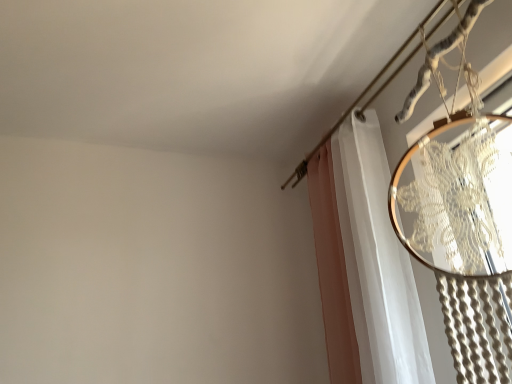
Question: Considering the positions of white sheer curtain at upper right and metallic silver clothesline at upper right in the image, is white sheer curtain at upper right taller or shorter than metallic silver clothesline at upper right?

Choices:
 (A) short
 (B) tall

Answer: (B)

Question: From a real-world perspective, is white sheer curtain at upper right positioned above or below metallic silver clothesline at upper right?

Choices:
 (A) above
 (B) below

Answer: (B)

Question: Looking at their shapes, would you say white sheer curtain at upper right is wider or thinner than metallic silver clothesline at upper right?

Choices:
 (A) wide
 (B) thin

Answer: (B)

Question: Does point (365, 89) appear closer or farther from the camera than point (318, 195)?

Choices:
 (A) closer
 (B) farther

Answer: (A)

Question: Considering the relative positions of metallic silver clothesline at upper right and white sheer curtain at upper right in the image provided, is metallic silver clothesline at upper right to the left or to the right of white sheer curtain at upper right?

Choices:
 (A) left
 (B) right

Answer: (B)

Question: Looking at the image, does metallic silver clothesline at upper right seem bigger or smaller compared to white sheer curtain at upper right?

Choices:
 (A) small
 (B) big

Answer: (A)

Question: From the image's perspective, is metallic silver clothesline at upper right located above or below white sheer curtain at upper right?

Choices:
 (A) above
 (B) below

Answer: (A)